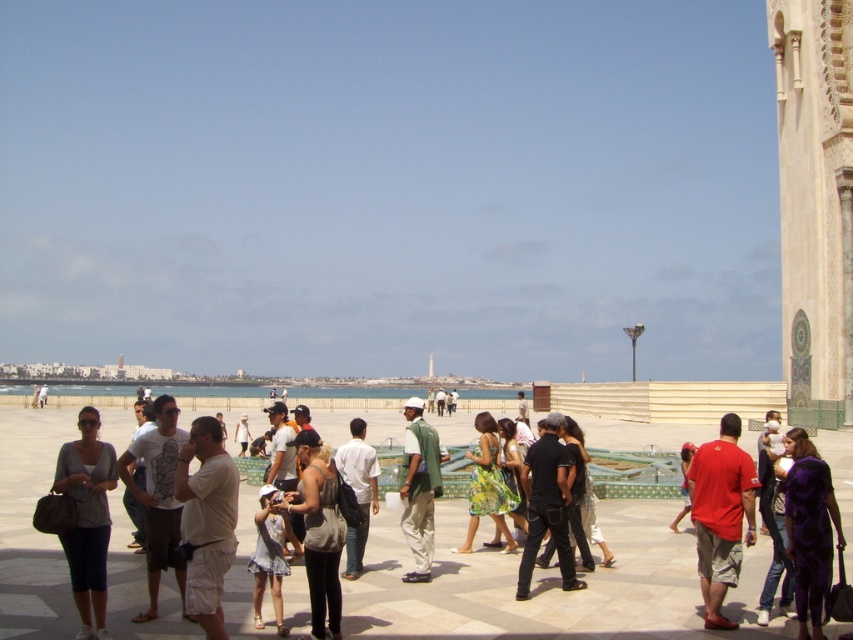
The width and height of the screenshot is (853, 640). Describe the element at coordinates (809, 529) in the screenshot. I see `purple satin dress at lower right` at that location.

Based on the photo, between purple satin dress at lower right and black matte pants at center, which one appears on the right side from the viewer's perspective?

From the viewer's perspective, purple satin dress at lower right appears more on the right side.

Locate an element on the screen. purple satin dress at lower right is located at coordinates (809, 529).

Is white cotton dress at center taller than white fabric dress at center?

Correct, white cotton dress at center is much taller as white fabric dress at center.

Describe the element at coordinates (270, 556) in the screenshot. I see `white cotton dress at center` at that location.

Where is `white cotton dress at center`? The width and height of the screenshot is (853, 640). white cotton dress at center is located at coordinates (270, 556).

Measure the distance from denim jacket at center to white cotton dress at center.

The distance of denim jacket at center from white cotton dress at center is 1.77 meters.

Is point (317, 513) more distant than point (296, 554)?

No, it is in front of (296, 554).

Identify the location of denim jacket at center. Image resolution: width=853 pixels, height=640 pixels. 318,532.